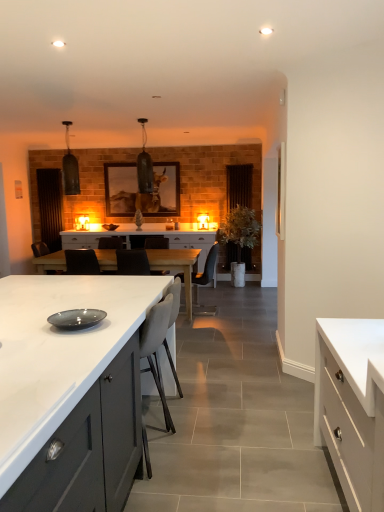
Find the location of a particular element. free space that is to the left of matte gray plate at center is located at coordinates click(x=28, y=325).